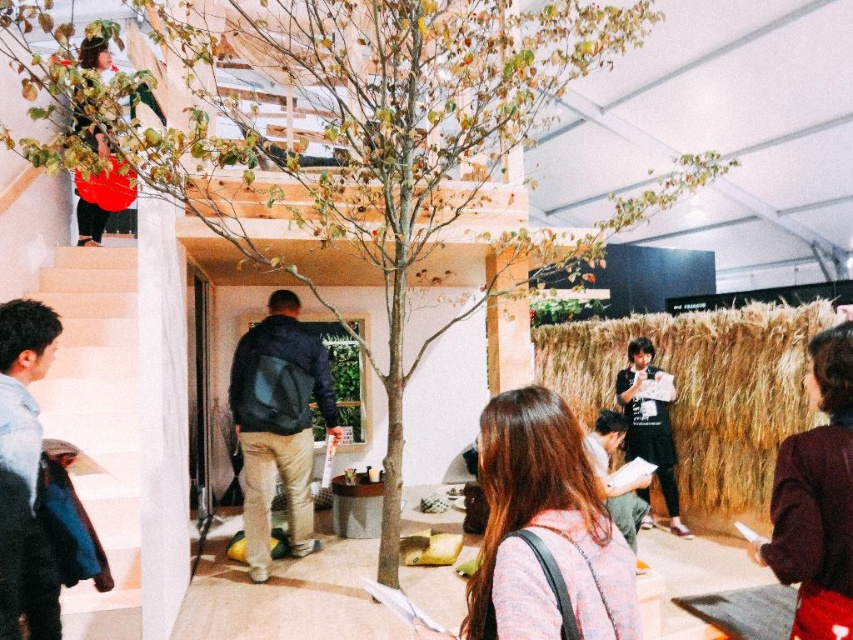
You are standing in the exhibition space and want to take a photo of the light brown hair at center without including the brown straw wall at right in the frame. Which direction should you move to achieve this?

The brown straw wall at right is to the right of the light brown hair at center. To avoid including the brown straw wall at right in the photo, you should move to the right side of the light brown hair at center, positioning yourself so the wall is out of the frame.

You are standing at the center of the room and see the small tree with thin branches and green leaves positioned centrally. There is also a point marked at coordinates (97, 419). What object is located at those coordinates?

The point at coordinates (97, 419) marks white matte stairs at lower left.

You are a photographer setting up a tripod in the lower left corner of the exhibition space. You need to place the tripod between the white matte stairs at lower left and the blue denim jacket at lower left. Can the tripod fit between them if it requires 1 meter of space?

The white matte stairs at lower left is wider than the blue denim jacket at lower left, but the exact dimensions are not provided. Therefore, it is uncertain if the tripod can fit between them with 1 meter of space required.